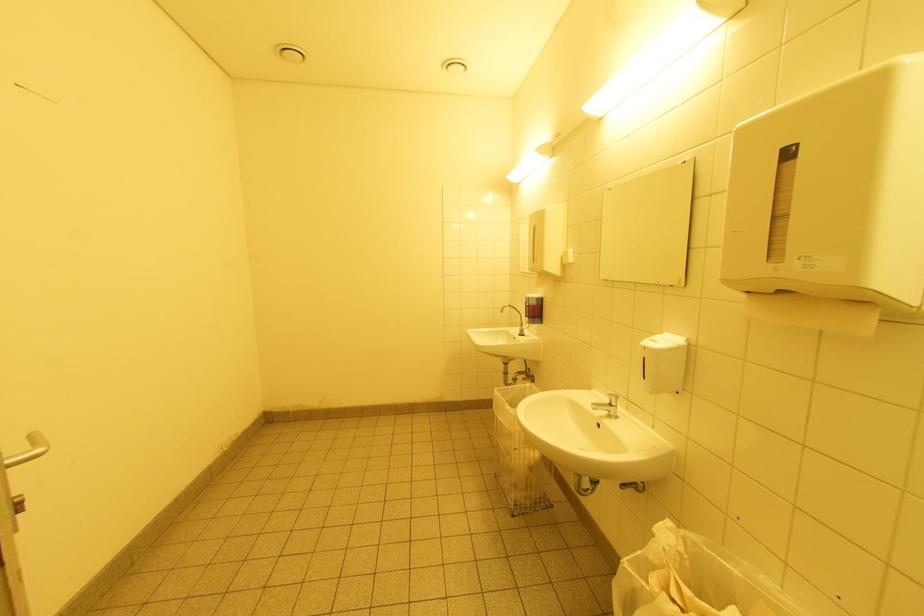
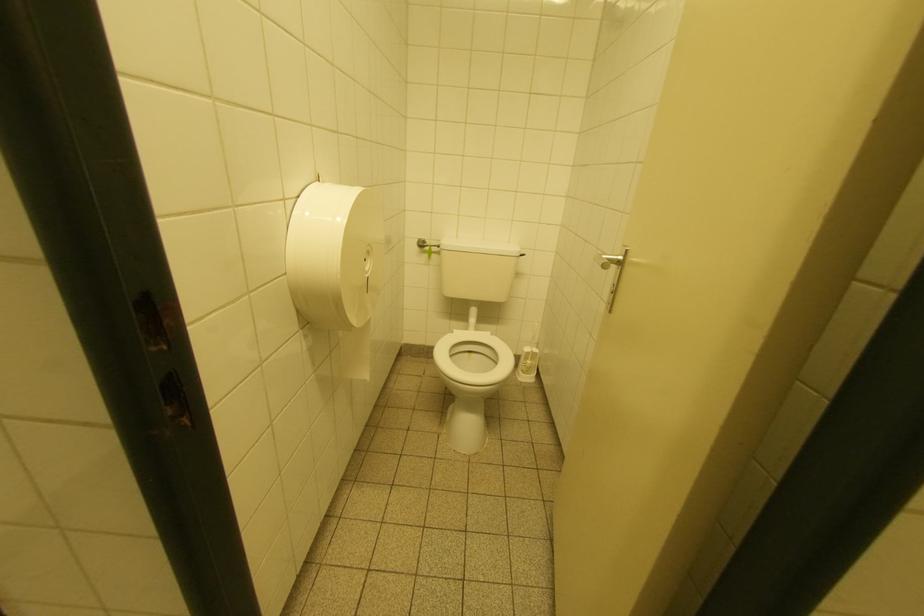
Question: What movement of the cameraman would produce the second image?

Choices:
 (A) Left
 (B) Right
 (C) Forward
 (D) Backward

Answer: (A)